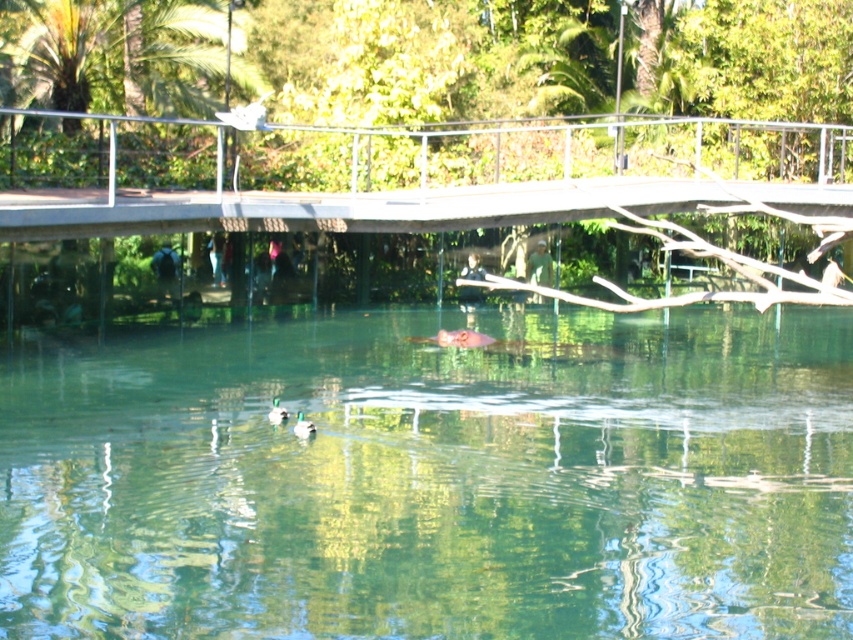
Question: Estimate the real-world distances between objects in this image. Which object is farther from the metal bridge at center?

Choices:
 (A) green matte duck at center
 (B) clear water at center
 (C) green matte duck at lower center

Answer: (C)

Question: Which object is positioned farthest from the green matte duck at lower center?

Choices:
 (A) metal bridge at center
 (B) green matte duck at center
 (C) clear water at center

Answer: (A)

Question: Does clear water at center appear on the left side of green matte duck at lower center?

Choices:
 (A) yes
 (B) no

Answer: (B)

Question: Which point is closer to the camera?

Choices:
 (A) clear water at center
 (B) green matte duck at lower center

Answer: (A)

Question: Can you confirm if green matte duck at lower center is thinner than green matte duck at center?

Choices:
 (A) yes
 (B) no

Answer: (A)

Question: Considering the relative positions of metal bridge at center and green matte duck at center in the image provided, where is metal bridge at center located with respect to green matte duck at center?

Choices:
 (A) right
 (B) left

Answer: (A)